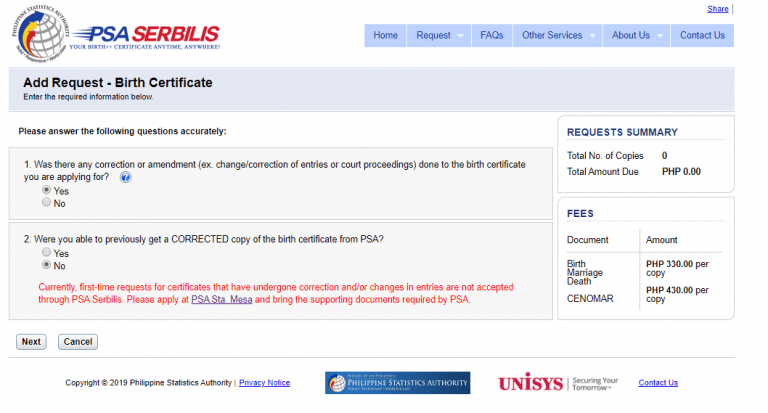
At what (x,y) coordinates should I click in order to perform the action: click on globe. Please return your answer as a coordinate pair (x, y). This screenshot has width=768, height=413. Looking at the image, I should click on (343, 379), (35, 23).